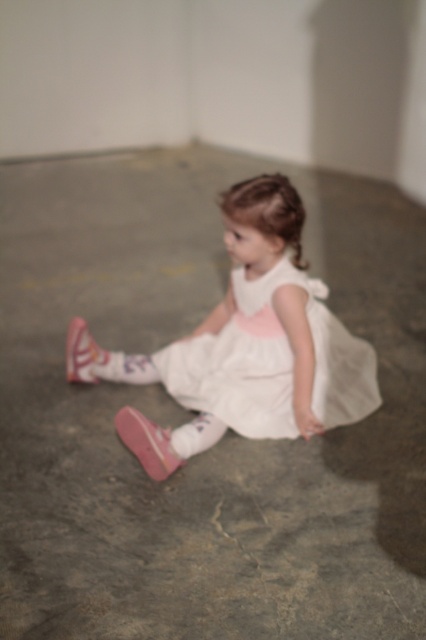
Question: Which point is closer to the camera?

Choices:
 (A) pink fabric sock at lower left
 (B) white satin dress at center
 (C) pink fabric dress at center
 (D) pink suede shoe at lower left

Answer: (C)

Question: Can you confirm if pink fabric dress at center is smaller than pink fabric sock at lower center?

Choices:
 (A) no
 (B) yes

Answer: (A)

Question: Estimate the real-world distances between objects in this image. Which object is farther from the pink fabric dress at center?

Choices:
 (A) pink fabric sock at lower left
 (B) pink suede shoe at lower left

Answer: (B)

Question: Is pink suede shoe at lower left above pink fabric sock at lower left?

Choices:
 (A) yes
 (B) no

Answer: (A)

Question: Among these objects, which one is nearest to the camera?

Choices:
 (A) pink fabric sock at lower left
 (B) white satin dress at center

Answer: (B)

Question: Is pink fabric sock at lower left further to camera compared to pink fabric sock at lower center?

Choices:
 (A) no
 (B) yes

Answer: (B)